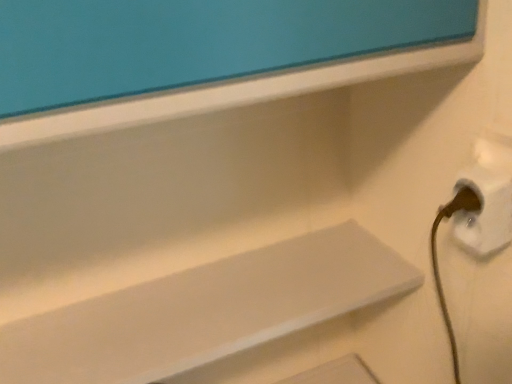
Question: From the image's perspective, is white matte shelf at center located above or below white plastic electric outlet at lower right?

Choices:
 (A) below
 (B) above

Answer: (A)

Question: Is white matte shelf at center spatially inside white plastic electric outlet at lower right, or outside of it?

Choices:
 (A) inside
 (B) outside

Answer: (B)

Question: Visually, is white matte shelf at center positioned to the left or to the right of white plastic electric outlet at lower right?

Choices:
 (A) left
 (B) right

Answer: (A)

Question: Considering the positions of point (508, 187) and point (339, 296), is point (508, 187) closer or farther from the camera than point (339, 296)?

Choices:
 (A) farther
 (B) closer

Answer: (B)

Question: From the image's perspective, is white plastic electric outlet at lower right located above or below white matte shelf at center?

Choices:
 (A) above
 (B) below

Answer: (A)

Question: Considering the positions of white plastic electric outlet at lower right and white matte shelf at center in the image, is white plastic electric outlet at lower right wider or thinner than white matte shelf at center?

Choices:
 (A) wide
 (B) thin

Answer: (B)

Question: Relative to white matte shelf at center, is white plastic electric outlet at lower right in front or behind?

Choices:
 (A) behind
 (B) front

Answer: (B)